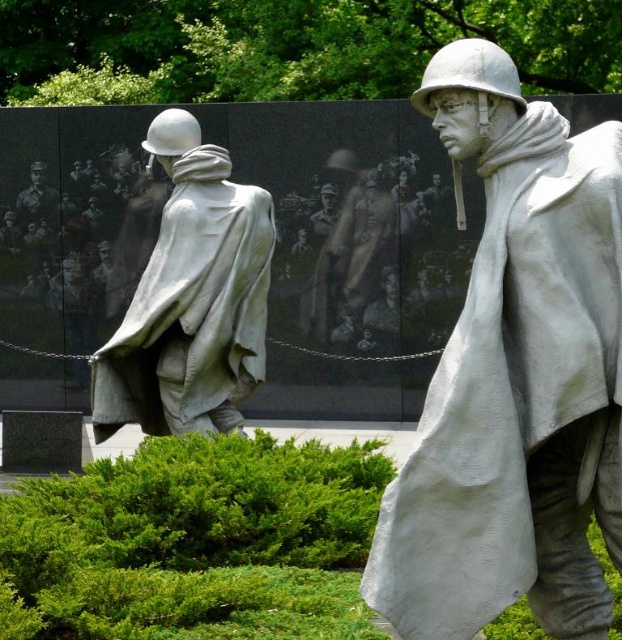
You are standing in front of the memorial and want to touch the two points on the image. The first point is at coordinate point (583,502) and the second is at point (55,204). Which point will you reach first if you move towards them?

Point (583,502) is closer to the viewer than point (55,204), so you will reach point (583,502) first.

You are standing at the point marked by the coordinate point at point (141, 410). You want to take a photo of the soldier on the left. Is the soldier on the left within your camera frame?

The distance of point (141, 410) from camera is 10.61 meters. Since the soldier on the left is part of the scene and the point is at that coordinate, the soldier on the left is likely within the camera frame as the distance is within a typical camera range.